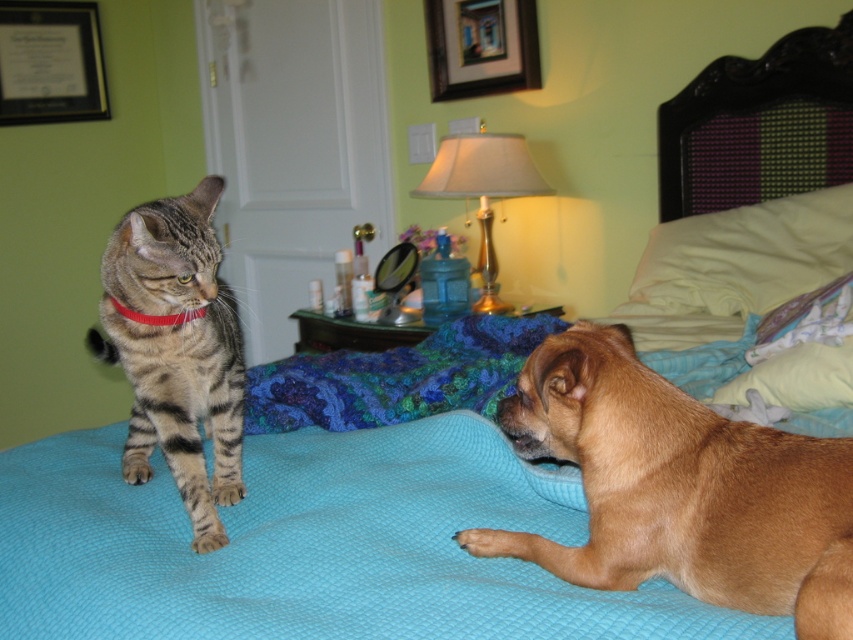
You are lying on the bed and want to grab the closest object from either the white soft pillow at upper right or the matte black frame at upper left. Which one should you reach for?

The white soft pillow at upper right is closer to the viewer, so you should reach for the white soft pillow at upper right.

You are an interior designer working on a project and need to place a new painting exactly at point 0.098, 0.060 in the room. You look at the image of the bedroom and see the matte black frame at upper left. Is there already an object at that coordinate where you want to place the new painting?

Yes, there is already an object at point (50, 61), which is the matte black frame at upper left.

You are standing at the foot of the bed in this cozy bedroom scene. You notice a gold metallic lampshade at upper center marked by point (483, 189). If you want to reach the lampshade to turn it on, which direction should you move relative to the tabby cat on the left side of the bed?

The gold metallic lampshade at upper center is marked by point (483, 189). Since you are at the foot of the bed, you should move towards the head of the bed where the lampshade is located. The tabby cat is on the left side, so moving towards the upper center would mean moving diagonally forward and to the left relative to the cat.